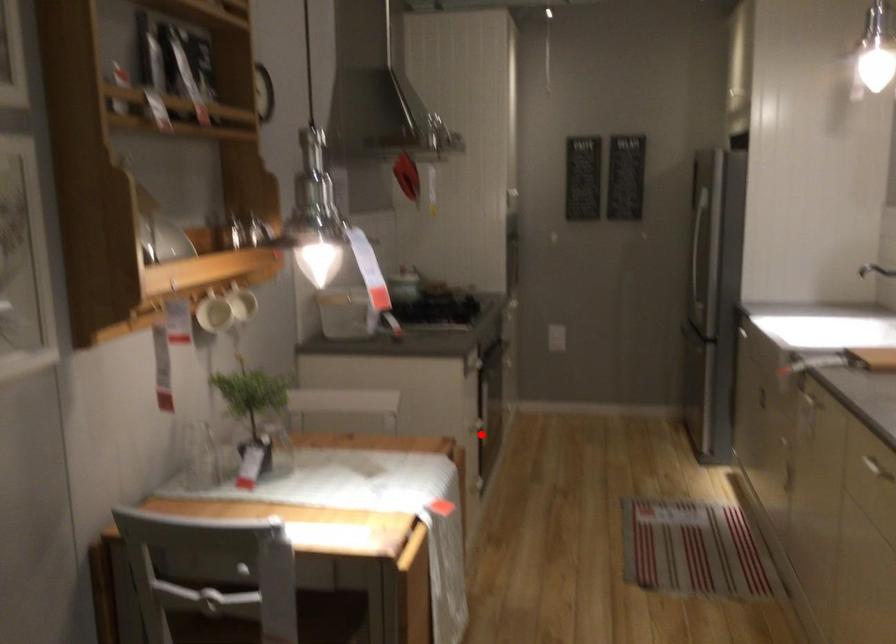
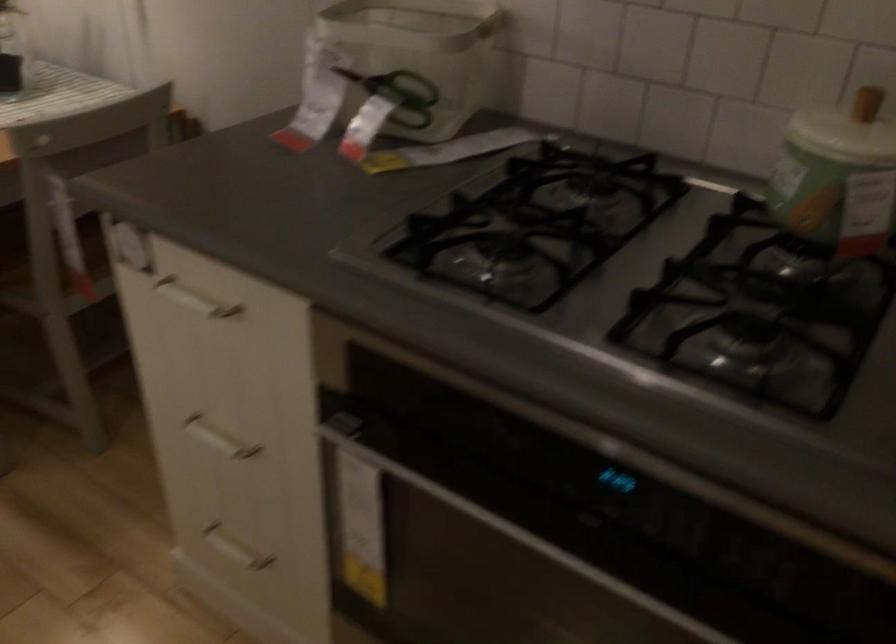
Question: I am providing you with two images of the same scene from different viewpoints. Image1 has a red point marked. In image2, the corresponding 3D location appears at what relative position? Reply with the corresponding letter.

Choices:
 (A) Closer
 (B) Farther

Answer: (A)